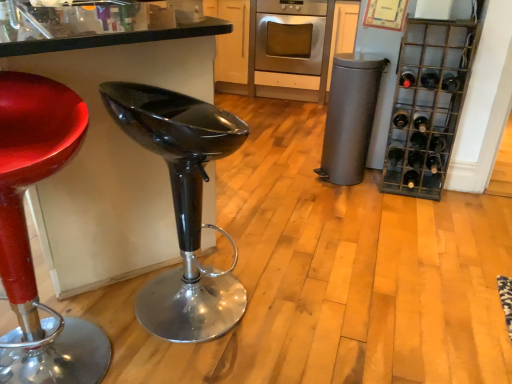
This screenshot has height=384, width=512. In order to click on vacant space to the right of black glass wine bottle at lower right, the 1th wine bottle from the bottom in this screenshot , I will do `click(435, 187)`.